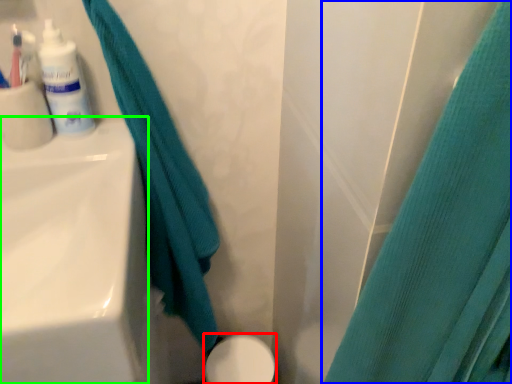
Question: Which object is the farthest from porcelain (highlighted by a red box)? Choose among these: curtain (highlighted by a blue box) or sink (highlighted by a green box).

Choices:
 (A) curtain
 (B) sink

Answer: (A)